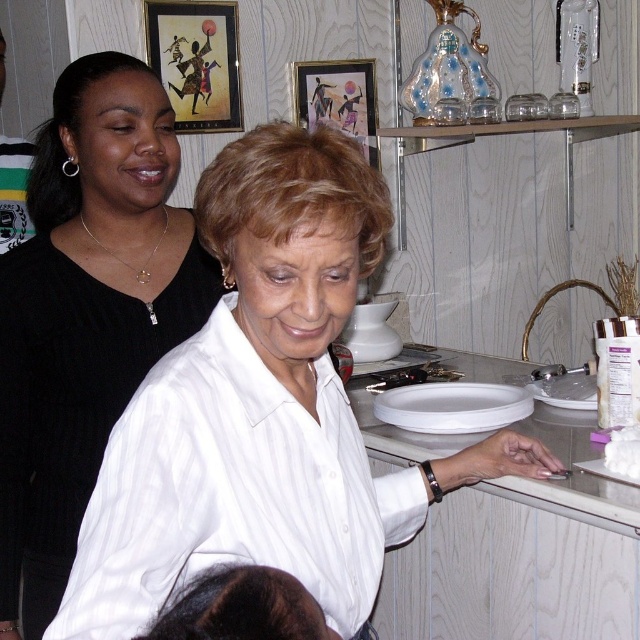
You are standing at the entrance of the event and want to locate the woman in the black matte shirt at upper left. According to the coordinates provided, where should you look?

The woman in the black matte shirt at upper left is located at coordinates point (86, 310), so you should look towards the upper left area of the image.

From the picture: You are a guest at this event and want to place a small dessert plate between the white matte shirt at center and the white glossy counter top at center. Based on their widths, can you determine which object you should place it closer to?

The white matte shirt at center might be wider than white glossy counter top at center, so you should place the dessert plate closer to the white glossy counter top at center to ensure it fits properly.